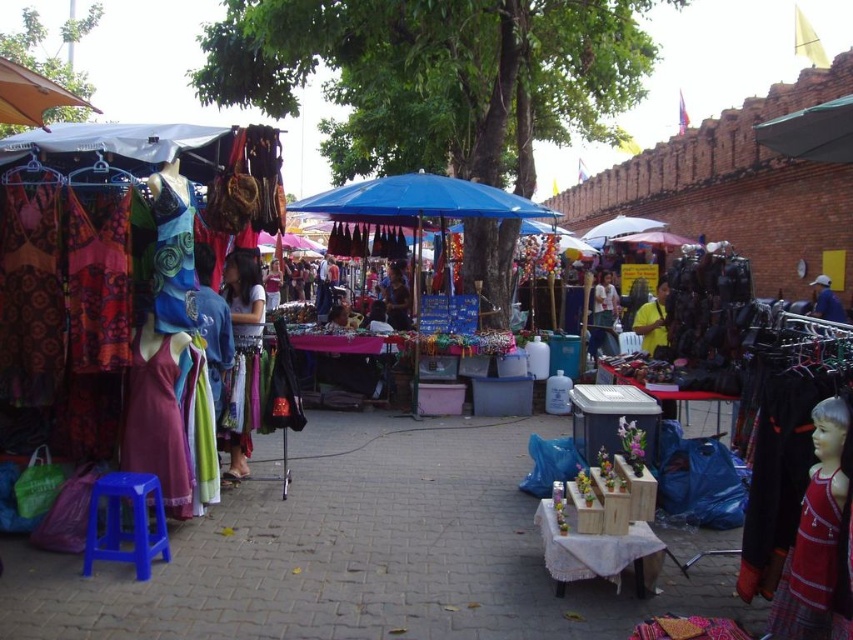
Question: Which of the following is the farthest from the observer?

Choices:
 (A) blue plastic stool at lower left
 (B) matte black dress at center
 (C) matte black bag at center
 (D) yellow cotton shirt at center

Answer: (B)

Question: Which of the following is the farthest from the observer?

Choices:
 (A) (838, 305)
 (B) (115, 472)
 (C) (299, 205)
 (D) (180, 234)

Answer: (A)

Question: Which point is closer to the camera?

Choices:
 (A) (650, 308)
 (B) (788, 634)
 (C) (161, 275)
 (D) (227, 433)

Answer: (B)

Question: Does blue printed fabric dress at left have a smaller size compared to matte green dress at center?

Choices:
 (A) no
 (B) yes

Answer: (A)

Question: Is blue printed fabric dress at left to the right of matte black dress at center from the viewer's perspective?

Choices:
 (A) yes
 (B) no

Answer: (B)

Question: Does blue plastic stool at lower left have a greater width compared to matte black bag at center?

Choices:
 (A) no
 (B) yes

Answer: (B)